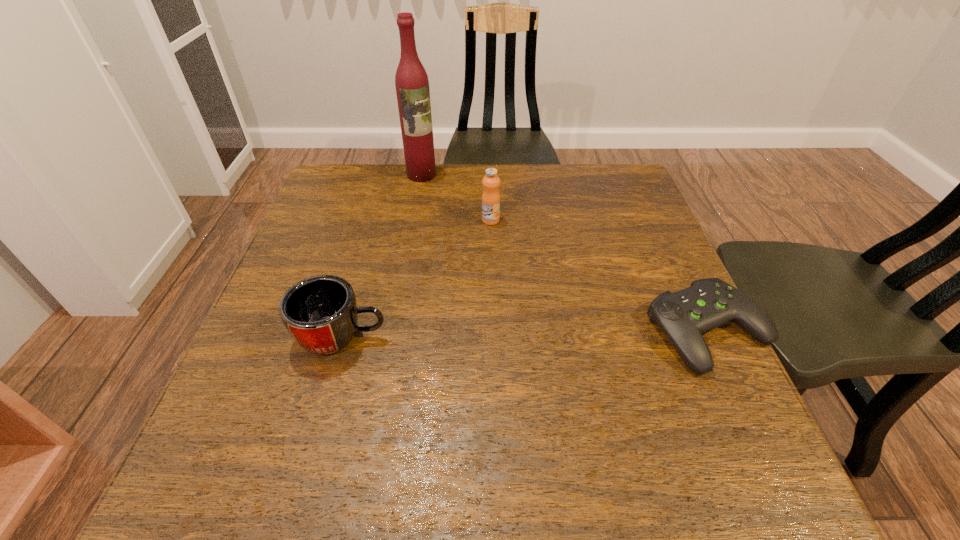
In the image, there is a desktop. Where is `vacant space at the left edge`? The image size is (960, 540). vacant space at the left edge is located at coordinates (354, 253).

This screenshot has height=540, width=960. In the image, there is a desktop. Identify the location of vacant area at the right edge. (674, 289).

The image size is (960, 540). I want to click on vacant space at the far left corner of the desktop, so click(x=337, y=177).

The height and width of the screenshot is (540, 960). What are the coordinates of `free region at the near left corner of the desktop` in the screenshot? It's located at (258, 413).

The image size is (960, 540). Identify the location of vacant space at the far right corner of the desktop. (579, 172).

Where is `vacant point located between the rightmost object and the mug`? Image resolution: width=960 pixels, height=540 pixels. vacant point located between the rightmost object and the mug is located at coordinates (525, 334).

Find the location of a particular element. empty space between the orange juice and the mug is located at coordinates (417, 278).

Where is `vacant point located between the rightmost object and the mug`? The width and height of the screenshot is (960, 540). vacant point located between the rightmost object and the mug is located at coordinates (525, 334).

Locate an element on the screen. empty location between the tallest object and the control is located at coordinates (565, 253).

Where is `blank region between the second shortest object and the tallest object`? The image size is (960, 540). blank region between the second shortest object and the tallest object is located at coordinates (382, 255).